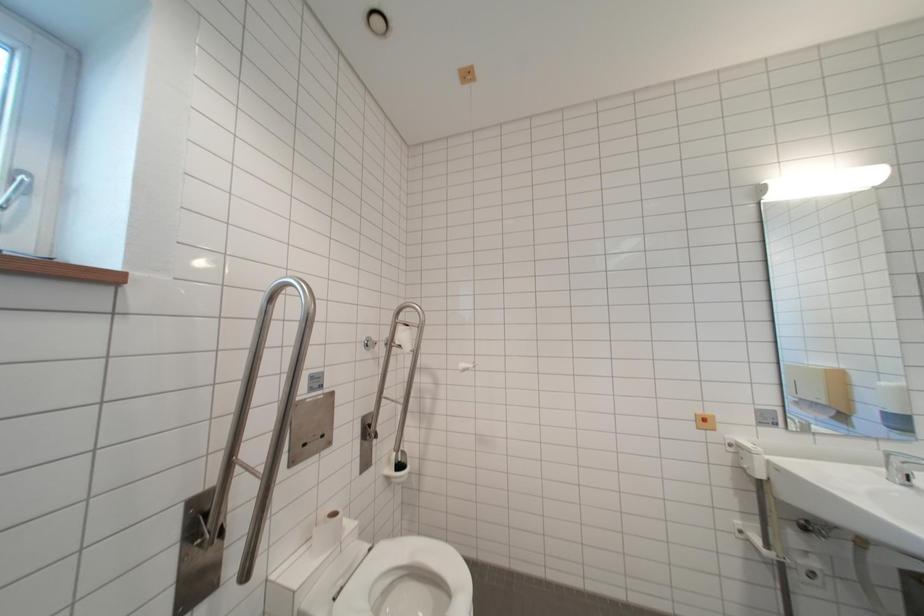
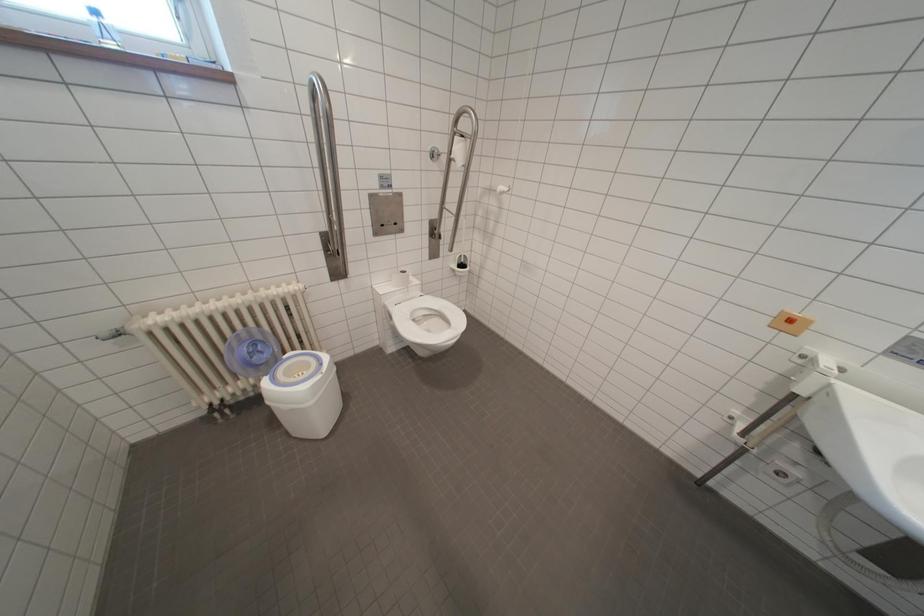
The images are taken continuously from a first-person perspective. In which direction is your viewpoint rotating?

The camera rotated toward left-down.